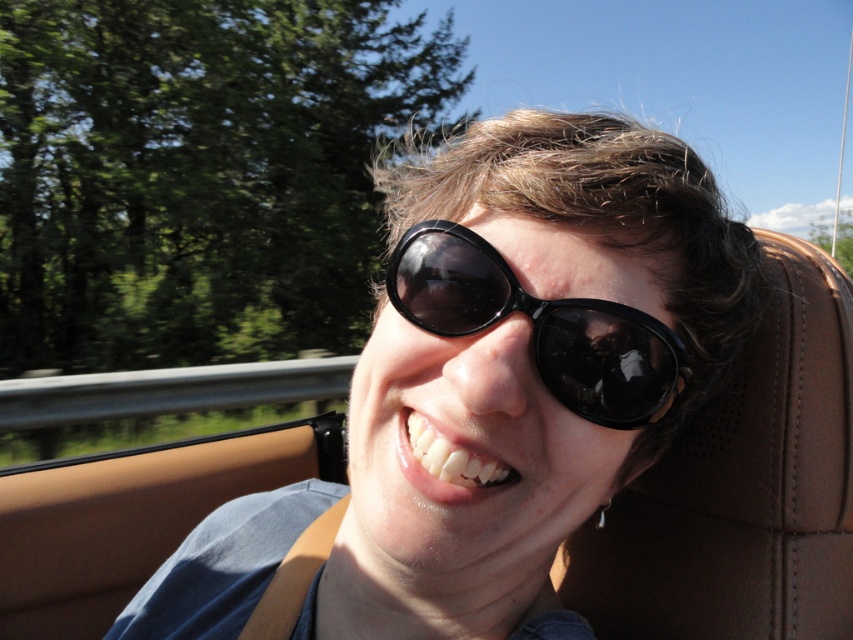
Question: Which point is closer to the camera?

Choices:
 (A) (554, 252)
 (B) (502, 468)

Answer: (A)

Question: Can you confirm if matte black sunglasses at center is bigger than white glossy teeth at center?

Choices:
 (A) no
 (B) yes

Answer: (B)

Question: Does matte black sunglasses at center appear over black glossy sunglasses at center?

Choices:
 (A) yes
 (B) no

Answer: (B)

Question: Estimate the real-world distances between objects in this image. Which object is closer to the black glossy sunglasses at center?

Choices:
 (A) matte black sunglasses at center
 (B) white glossy teeth at center

Answer: (A)

Question: Can you confirm if matte black sunglasses at center is positioned below white glossy teeth at center?

Choices:
 (A) yes
 (B) no

Answer: (A)

Question: Which point appears closest to the camera in this image?

Choices:
 (A) (669, 196)
 (B) (538, 356)
 (C) (471, 454)

Answer: (C)